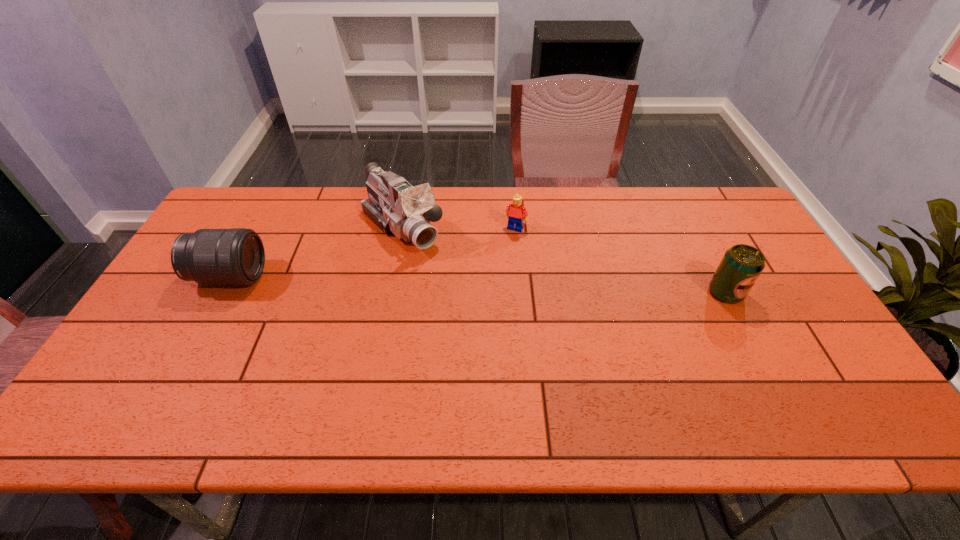
Find the location of `free spot at the right edge of the desktop`. free spot at the right edge of the desktop is located at coordinates (762, 325).

The image size is (960, 540). I want to click on vacant space in between the beer can and the tallest object, so click(564, 260).

This screenshot has width=960, height=540. In order to click on blank region between the telephoto lens and the second object from right to left in this screenshot , I will do `click(372, 253)`.

I want to click on vacant space that is in between the leftmost object and the beer can, so click(478, 285).

This screenshot has width=960, height=540. I want to click on free spot between the rightmost object and the third object from right to left, so click(x=564, y=260).

Identify the location of vacant area between the leftmost object and the Lego. The height and width of the screenshot is (540, 960). (372, 253).

At what (x,y) coordinates should I click in order to perform the action: click on free space between the rightmost object and the telephoto lens. Please return your answer as a coordinate pair (x, y). The image size is (960, 540). Looking at the image, I should click on (478, 285).

Locate an element on the screen. This screenshot has height=540, width=960. empty space that is in between the rightmost object and the second object from left to right is located at coordinates (564, 260).

Find the location of `vacant space that is in between the leftmost object and the camcorder`. vacant space that is in between the leftmost object and the camcorder is located at coordinates (316, 252).

The image size is (960, 540). What are the coordinates of `free space between the Lego and the beer can` in the screenshot? It's located at (620, 260).